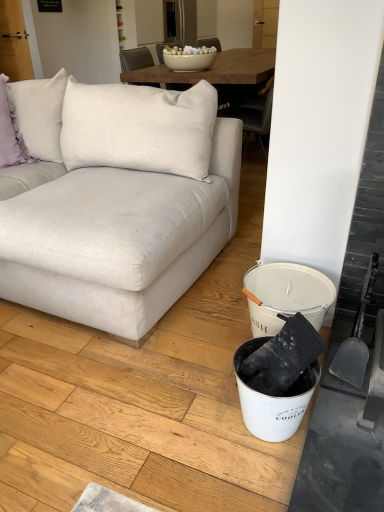
Question: Is gray plastic shovel at right located within white fabric couch at left?

Choices:
 (A) yes
 (B) no

Answer: (B)

Question: Does white fabric couch at left have a lesser height compared to gray plastic shovel at right?

Choices:
 (A) no
 (B) yes

Answer: (A)

Question: Is white fabric couch at left wider than gray plastic shovel at right?

Choices:
 (A) no
 (B) yes

Answer: (B)

Question: From the image's perspective, does white fabric couch at left appear lower than gray plastic shovel at right?

Choices:
 (A) no
 (B) yes

Answer: (A)

Question: Is white fabric couch at left behind gray plastic shovel at right?

Choices:
 (A) yes
 (B) no

Answer: (B)

Question: Is white fabric couch at left thinner than gray plastic shovel at right?

Choices:
 (A) yes
 (B) no

Answer: (B)

Question: Is lavender fabric pillow at upper left touching gray plastic shovel at right?

Choices:
 (A) no
 (B) yes

Answer: (A)

Question: From the image's perspective, does lavender fabric pillow at upper left appear higher than gray plastic shovel at right?

Choices:
 (A) yes
 (B) no

Answer: (A)

Question: Is lavender fabric pillow at upper left to the right of gray plastic shovel at right from the viewer's perspective?

Choices:
 (A) no
 (B) yes

Answer: (A)

Question: Is lavender fabric pillow at upper left positioned with its back to gray plastic shovel at right?

Choices:
 (A) yes
 (B) no

Answer: (B)

Question: From the image's perspective, is lavender fabric pillow at upper left located beneath gray plastic shovel at right?

Choices:
 (A) no
 (B) yes

Answer: (A)

Question: Considering the relative sizes of lavender fabric pillow at upper left and gray plastic shovel at right in the image provided, is lavender fabric pillow at upper left bigger than gray plastic shovel at right?

Choices:
 (A) yes
 (B) no

Answer: (A)

Question: From the image's perspective, is white fabric couch at left beneath lavender fabric pillow at upper left?

Choices:
 (A) no
 (B) yes

Answer: (B)